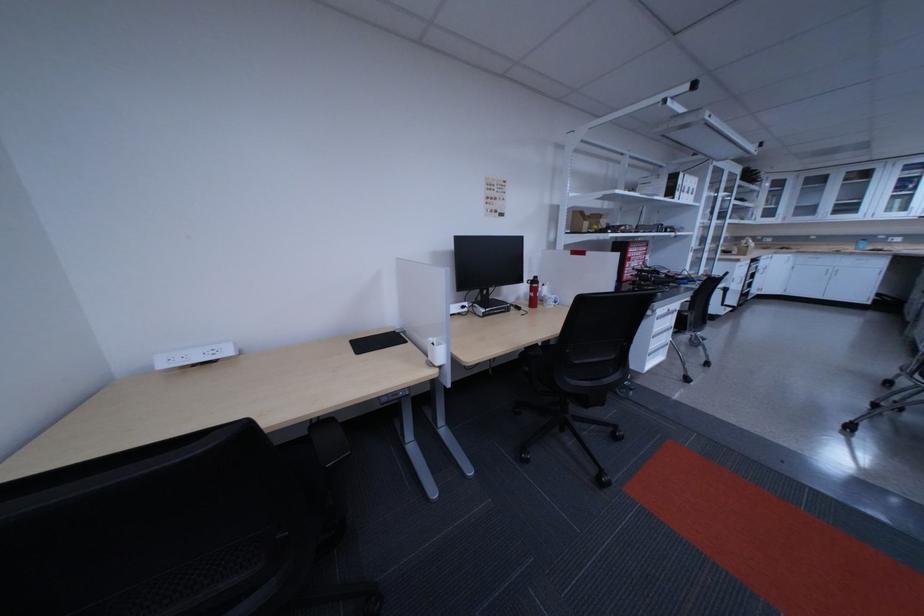
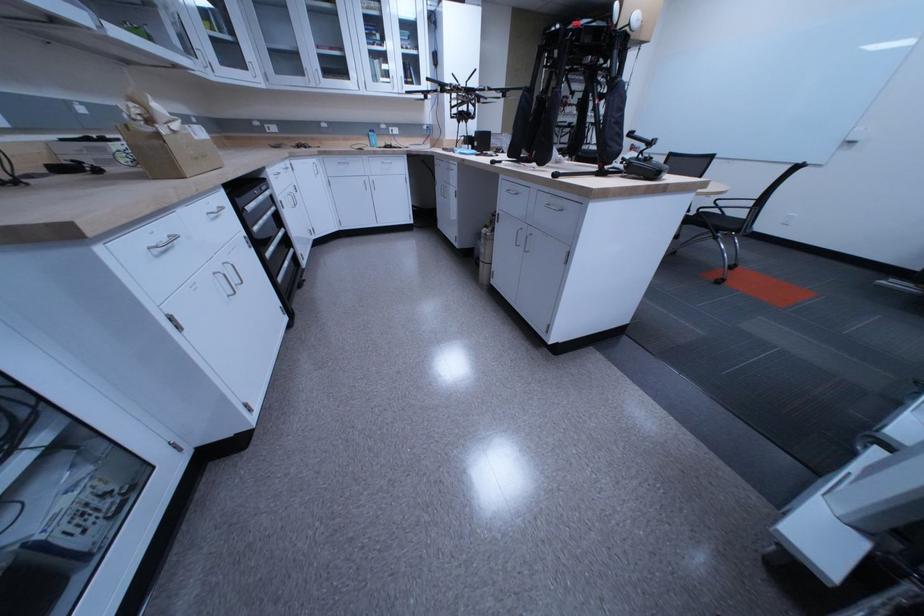
Locate, in the second image, the point that corresponds to (x=762, y=248) in the first image.

(174, 137)